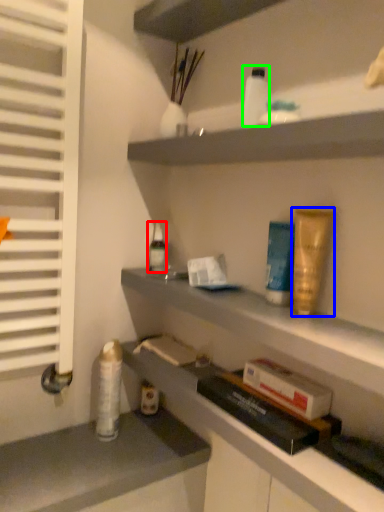
Question: Based on their relative distances, which object is nearer to toiletry (highlighted by a red box)? Choose from toiletry (highlighted by a blue box) and toiletry (highlighted by a green box).

Choices:
 (A) toiletry
 (B) toiletry

Answer: (B)